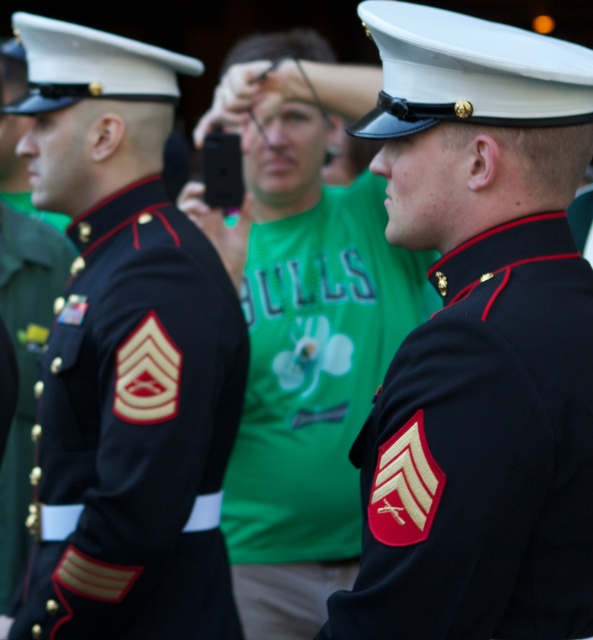
Question: Which point is farther from the camera taking this photo?

Choices:
 (A) (122, 227)
 (B) (263, 490)
 (C) (505, 291)
 (D) (27, 244)

Answer: (D)

Question: Estimate the real-world distances between objects in this image. Which object is farther from the navy blue fabric uniform at center?

Choices:
 (A) dark blue fabric uniform at center
 (B) shiny black uniform at left
 (C) black matte uniform at center

Answer: (C)

Question: Is navy blue fabric uniform at center closer to camera compared to shiny black uniform at left?

Choices:
 (A) yes
 (B) no

Answer: (A)

Question: Can you confirm if black matte uniform at center is positioned above navy blue fabric uniform at center?

Choices:
 (A) no
 (B) yes

Answer: (B)

Question: Which object appears closest to the camera in this image?

Choices:
 (A) black matte uniform at center
 (B) shiny black uniform at left

Answer: (A)

Question: Can you confirm if black matte uniform at center is positioned below shiny black uniform at left?

Choices:
 (A) no
 (B) yes

Answer: (A)